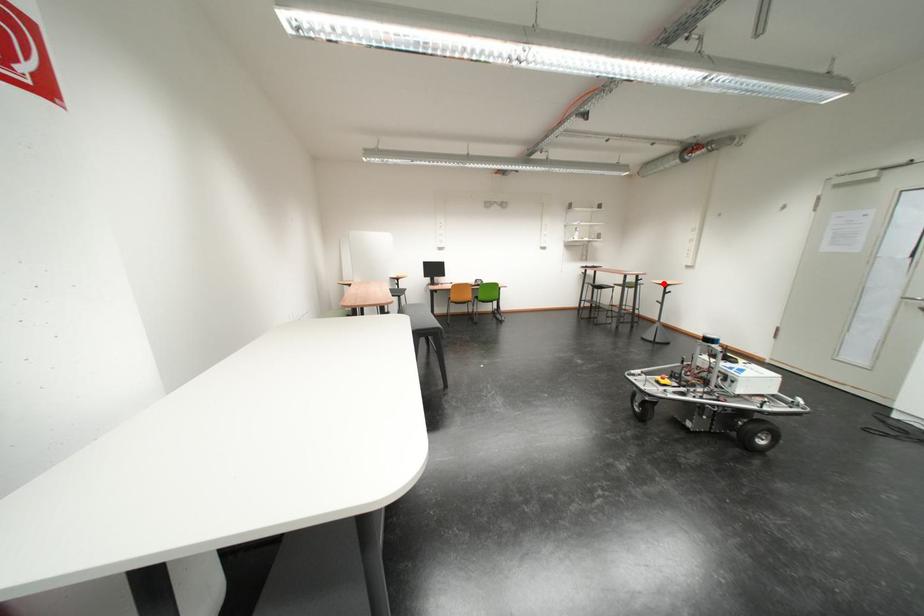
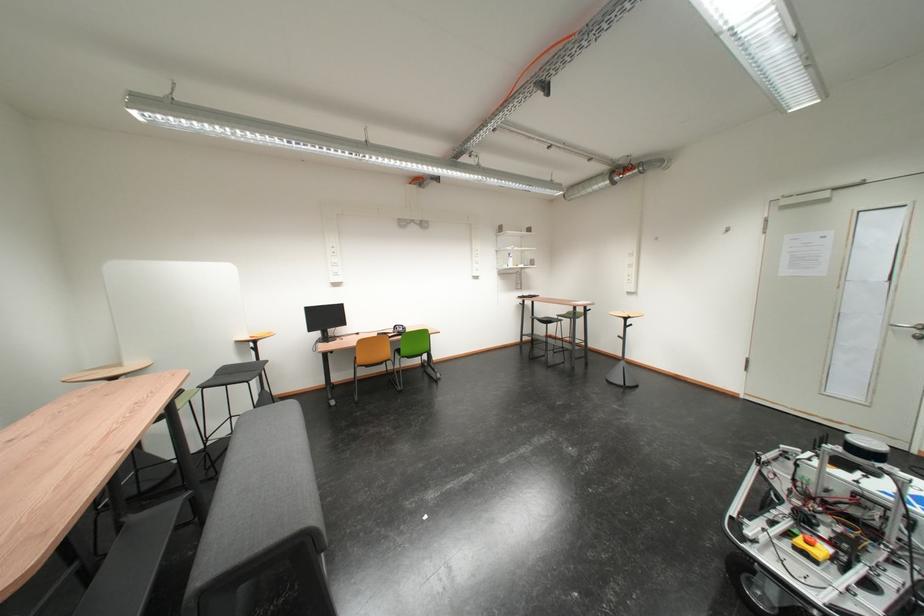
Question: I am providing you with two images of the same scene from different viewpoints. Given a red point in image1, look at the same physical point in image2. Is it:

Choices:
 (A) Closer to the viewpoint
 (B) Farther from the viewpoint

Answer: (B)